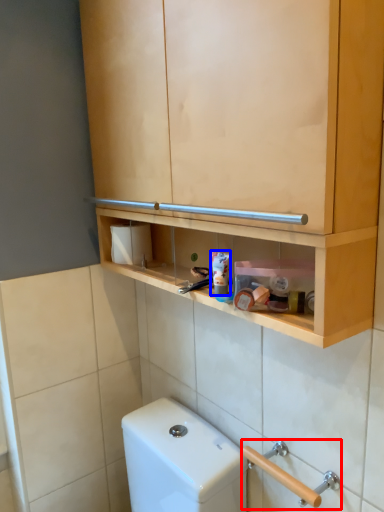
Question: Which of the following is the farthest to the observer, door handle (highlighted by a red box) or toothpaste (highlighted by a blue box)?

Choices:
 (A) door handle
 (B) toothpaste

Answer: (B)